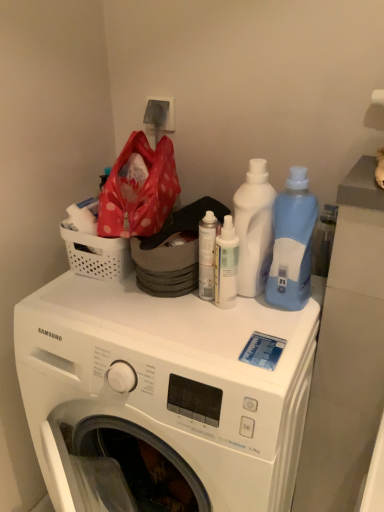
Locate an element on the screen. The image size is (384, 512). vacant space to the right of white matte spray can at center is located at coordinates coord(274,313).